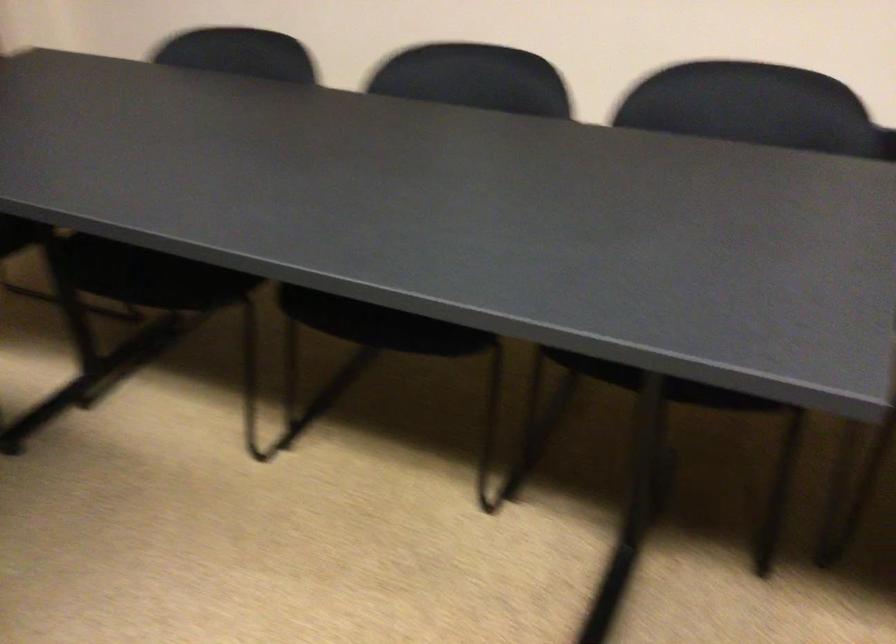
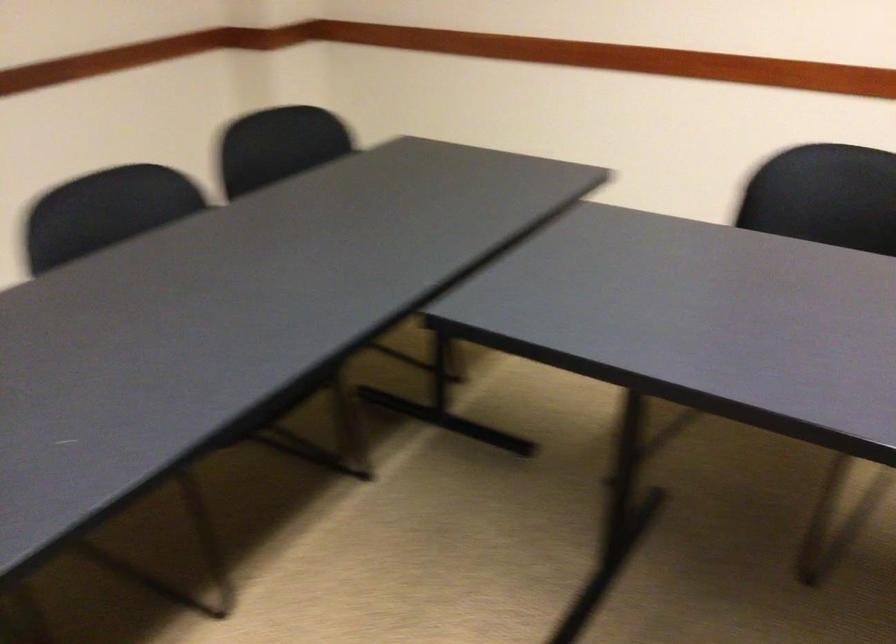
From the picture: The images are taken continuously from a first-person perspective. In which direction is your viewpoint rotating?

The camera's rotation is toward right-down.